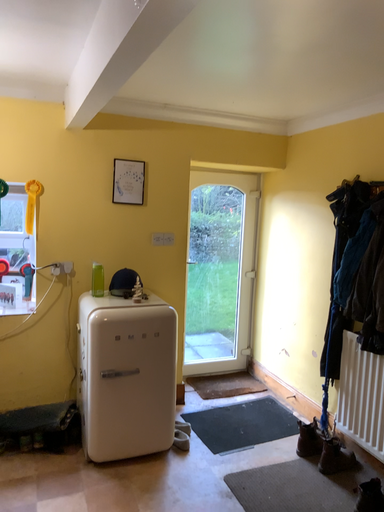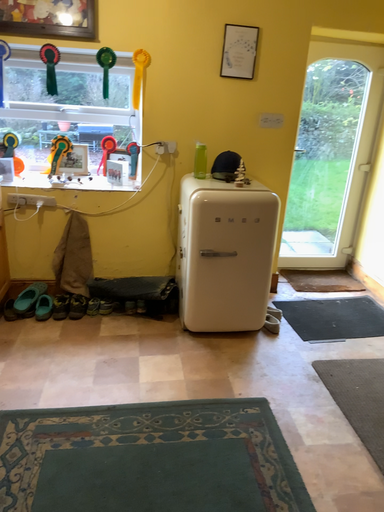
Question: How did the camera likely rotate when shooting the video?

Choices:
 (A) rotated right
 (B) rotated left

Answer: (B)